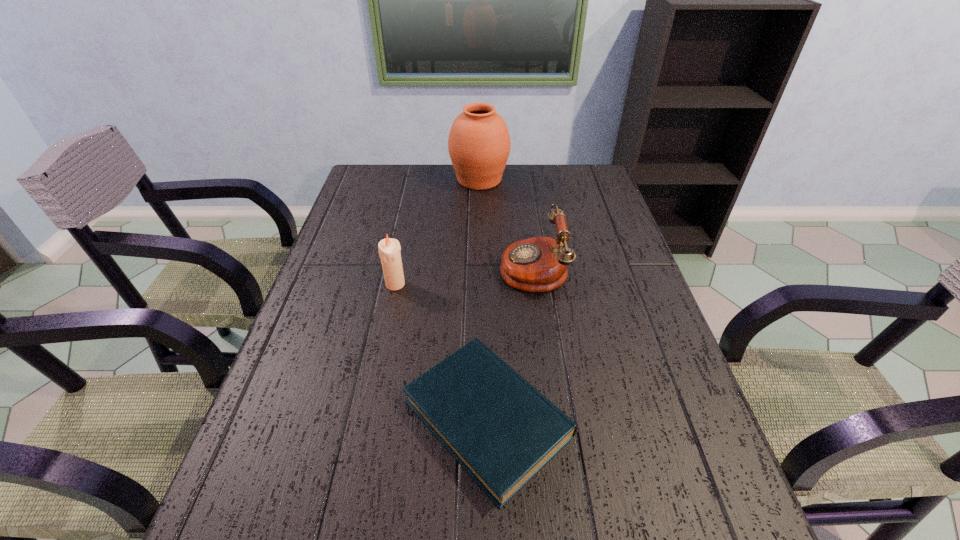
Locate an element on the screen. urn is located at coordinates (479, 143).

I want to click on the farthest object, so click(479, 143).

You are a GUI agent. You are given a task and a screenshot of the screen. Output one action in this format:
    pyautogui.click(x=<x>, y=<y>)
    Task: Click on the telephone
    The image size is (960, 540).
    Given the screenshot: What is the action you would take?
    pyautogui.click(x=539, y=264)

Where is `the leftmost object`? The image size is (960, 540). the leftmost object is located at coordinates (389, 249).

Locate an element on the screen. This screenshot has height=540, width=960. the shortest object is located at coordinates (502, 431).

Where is `book`? The height and width of the screenshot is (540, 960). book is located at coordinates (502, 431).

Image resolution: width=960 pixels, height=540 pixels. Identify the location of vacant area situated 0.330m on the left of the urn. (356, 180).

Locate an element on the screen. Image resolution: width=960 pixels, height=540 pixels. free region located on the dial of the telephone is located at coordinates point(354,266).

I want to click on vacant space located on the dial of the telephone, so click(x=412, y=266).

Find the location of a particular element. free space located on the dial of the telephone is located at coordinates (467, 266).